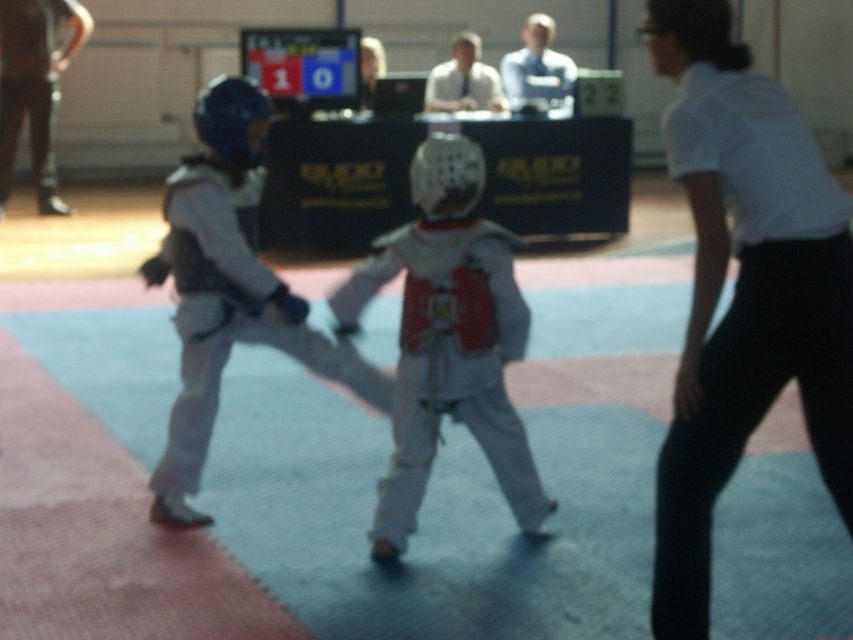
Question: Can you confirm if white matte helmet at center is positioned below white matte karate uniform at center?

Choices:
 (A) no
 (B) yes

Answer: (B)

Question: Which of the following is the farthest from the observer?

Choices:
 (A) white matte helmet at center
 (B) white matte karate uniform at center

Answer: (B)

Question: Can you confirm if white matte helmet at center is positioned to the left of white matte karate uniform at center?

Choices:
 (A) yes
 (B) no

Answer: (B)

Question: Among these objects, which one is farthest from the camera?

Choices:
 (A) white matte helmet at center
 (B) white matte karate uniform at center

Answer: (B)

Question: Does white matte helmet at center appear under white matte karate uniform at center?

Choices:
 (A) no
 (B) yes

Answer: (B)

Question: Among these points, which one is nearest to the camera?

Choices:
 (A) (181, 208)
 (B) (505, 344)

Answer: (A)